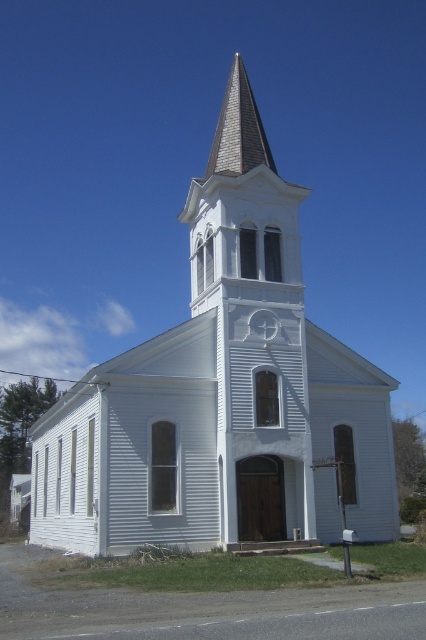
Question: Considering the real-world distances, which object is closest to the gray shingles at upper center?

Choices:
 (A) white wooden church at center
 (B) gray shingles steeple at center

Answer: (B)

Question: Which of the following is the closest to the observer?

Choices:
 (A) (230, 152)
 (B) (294, 280)

Answer: (B)

Question: Is white wooden church at center thinner than gray shingles at upper center?

Choices:
 (A) no
 (B) yes

Answer: (A)

Question: Is white wooden church at center to the left of gray shingles at upper center from the viewer's perspective?

Choices:
 (A) yes
 (B) no

Answer: (A)

Question: Which point is farther to the camera?

Choices:
 (A) (149, 538)
 (B) (233, 97)
 (C) (270, 237)

Answer: (B)

Question: Is gray shingles steeple at center positioned in front of gray shingles at upper center?

Choices:
 (A) yes
 (B) no

Answer: (A)